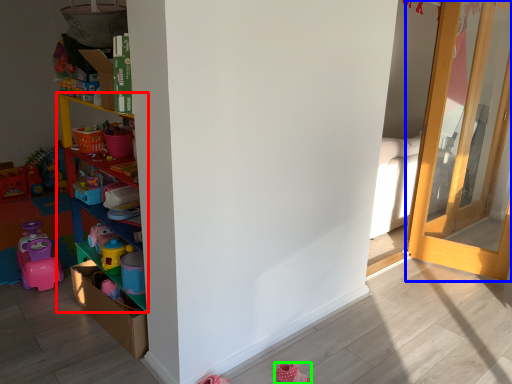
Question: Based on their relative distances, which object is farther from shelf (highlighted by a red box)? Choose from door (highlighted by a blue box) and shoe (highlighted by a green box).

Choices:
 (A) door
 (B) shoe

Answer: (A)